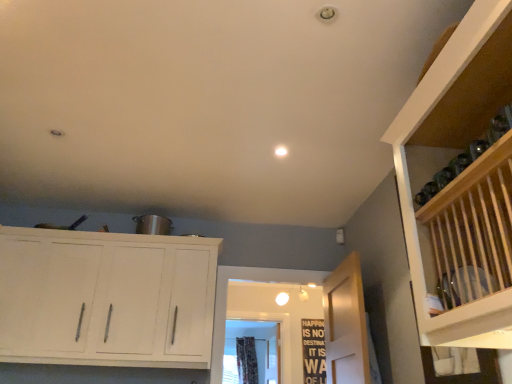
Identify the location of black wood signboard at center. This screenshot has height=384, width=512. (313, 351).

In order to click on wooden door at center in this screenshot , I will do `click(346, 324)`.

You are a GUI agent. You are given a task and a screenshot of the screen. Output one action in this format:
    pyautogui.click(x=<x>, y=<y>)
    Task: Click on the white wood cabinet at upper left
    
    Given the screenshot: What is the action you would take?
    pyautogui.click(x=106, y=298)

Find the location of a particular element. Image resolution: width=512 pixels, height=384 pixels. black wood signboard at center is located at coordinates (313, 351).

Based on the photo, does white wood cabinet at upper left lie in front of wooden door at center?

That is False.

Is white wood cabinet at upper left bigger than wooden door at center?

Indeed, white wood cabinet at upper left has a larger size compared to wooden door at center.

Considering the points (81, 292) and (345, 343), which point is in front, point (81, 292) or point (345, 343)?

Positioned in front is point (345, 343).

Between white wood cabinet at upper left and wooden door at center, which one has larger width?

Wider between the two is white wood cabinet at upper left.

Are floral fabric curtain at center and white wood cabinet at upper left located far from each other?

That's right, there is a large distance between floral fabric curtain at center and white wood cabinet at upper left.

From the image's perspective, is floral fabric curtain at center under white wood cabinet at upper left?

Yes.

Which object is further away from the camera taking this photo, floral fabric curtain at center or white wood cabinet at upper left?

floral fabric curtain at center.

Who is shorter, floral fabric curtain at center or white wood cabinet at upper left?

white wood cabinet at upper left is shorter.

From a real-world perspective, is wooden door at center beneath white wood cabinet at upper left?

Indeed, from a real-world perspective, wooden door at center is positioned beneath white wood cabinet at upper left.

Can you confirm if wooden door at center is thinner than white wood cabinet at upper left?

Indeed, wooden door at center has a lesser width compared to white wood cabinet at upper left.

Who is taller, wooden door at center or white wood cabinet at upper left?

With more height is white wood cabinet at upper left.

Can you tell me how much white wood cabinet at upper left and floral fabric curtain at center differ in facing direction?

white wood cabinet at upper left and floral fabric curtain at center are facing 1.75 degrees away from each other.

Is white wood cabinet at upper left turned away from floral fabric curtain at center?

That's right, white wood cabinet at upper left is facing away from floral fabric curtain at center.

From a real-world perspective, is white wood cabinet at upper left below floral fabric curtain at center?

Yes, from a real-world perspective, white wood cabinet at upper left is beneath floral fabric curtain at center.

Considering the relative positions of black wood signboard at center and wooden door at center in the image provided, is black wood signboard at center to the left of wooden door at center from the viewer's perspective?

In fact, black wood signboard at center is to the right of wooden door at center.

Is black wood signboard at center bigger than wooden door at center?

Incorrect, black wood signboard at center is not larger than wooden door at center.

How distant is black wood signboard at center from wooden door at center?

The distance of black wood signboard at center from wooden door at center is 1.82 meters.

From the image's perspective, is black wood signboard at center located above or below wooden door at center?

black wood signboard at center is situated lower than wooden door at center in the image.

Considering the points (323, 340) and (188, 329), which point is behind, point (323, 340) or point (188, 329)?

The point (323, 340) is farther from the camera.

From a real-world perspective, does black wood signboard at center sit lower than white wood cabinet at upper left?

Yes.

Is black wood signboard at center at the right side of white wood cabinet at upper left?

Yes.

Which of these two, black wood signboard at center or white wood cabinet at upper left, is wider?

white wood cabinet at upper left is wider.

From the image's perspective, between wooden door at center and black wood signboard at center, which one is located above?

From the image's view, wooden door at center is above.

Is wooden door at center placed right next to black wood signboard at center?

wooden door at center is not next to black wood signboard at center, and they're not touching.

Considering the relative sizes of wooden door at center and black wood signboard at center in the image provided, is wooden door at center smaller than black wood signboard at center?

No, wooden door at center is not smaller than black wood signboard at center.

In the image, is wooden door at center on the left side or the right side of black wood signboard at center?

From the image, it's evident that wooden door at center is to the left of black wood signboard at center.

At what (x,y) coordinates should I click in order to perform the action: click on cupboard that is on the left side of wooden door at center. Please return your answer as a coordinate pair (x, y). This screenshot has height=384, width=512. Looking at the image, I should click on (106, 298).

Where is `curtain behind the white wood cabinet at upper left`? Image resolution: width=512 pixels, height=384 pixels. curtain behind the white wood cabinet at upper left is located at coordinates (246, 360).

From the picture: Estimate the real-world distances between objects in this image. Which object is closer to white wood cabinet at upper left, floral fabric curtain at center or black wood signboard at center?

The object closer to white wood cabinet at upper left is black wood signboard at center.

Based on their spatial positions, is wooden door at center or black wood signboard at center closer to white wood cabinet at upper left?

wooden door at center is closer to white wood cabinet at upper left.

Estimate the real-world distances between objects in this image. Which object is closer to floral fabric curtain at center, white wood cabinet at upper left or black wood signboard at center?

The object closer to floral fabric curtain at center is black wood signboard at center.

From the image, which object appears to be nearer to wooden door at center, white wood cabinet at upper left or floral fabric curtain at center?

white wood cabinet at upper left is positioned closer to the anchor wooden door at center.

From the image, which object appears to be farther from floral fabric curtain at center, wooden door at center or black wood signboard at center?

wooden door at center.

Considering their positions, is black wood signboard at center positioned further to floral fabric curtain at center than white wood cabinet at upper left?

white wood cabinet at upper left.

Based on their spatial positions, is wooden door at center or floral fabric curtain at center further from white wood cabinet at upper left?

floral fabric curtain at center lies further to white wood cabinet at upper left than the other object.

Based on their spatial positions, is white wood cabinet at upper left or floral fabric curtain at center closer to black wood signboard at center?

floral fabric curtain at center lies closer to black wood signboard at center than the other object.

This screenshot has height=384, width=512. Find the location of `cupboard between wooden door at center and floral fabric curtain at center in the front-back direction`. cupboard between wooden door at center and floral fabric curtain at center in the front-back direction is located at coordinates (106, 298).

In order to click on cupboard between wooden door at center and black wood signboard at center from front to back in this screenshot , I will do `click(106, 298)`.

In order to click on bulletin board positioned between white wood cabinet at upper left and floral fabric curtain at center from near to far in this screenshot , I will do `click(313, 351)`.

Find the location of `bulletin board located between wooden door at center and floral fabric curtain at center in the depth direction`. bulletin board located between wooden door at center and floral fabric curtain at center in the depth direction is located at coordinates (313, 351).